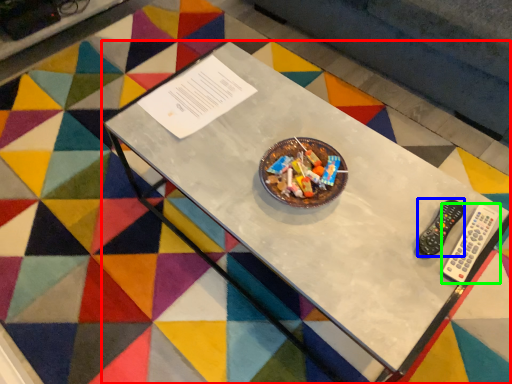
Question: Considering the real-world distances, which object is farthest from table (highlighted by a red box)? control (highlighted by a blue box) or remote control (highlighted by a green box)?

Choices:
 (A) control
 (B) remote control

Answer: (B)